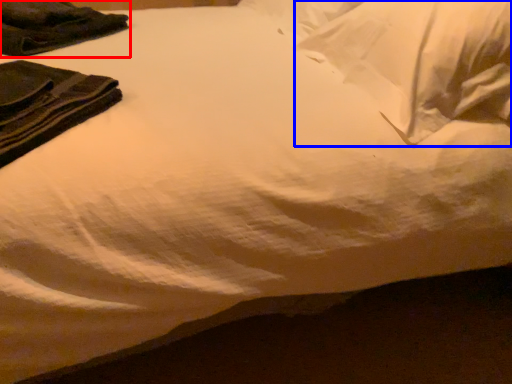
Question: Which object appears closest to the camera in this image, clothing (highlighted by a red box) or pillow (highlighted by a blue box)?

Choices:
 (A) clothing
 (B) pillow

Answer: (B)